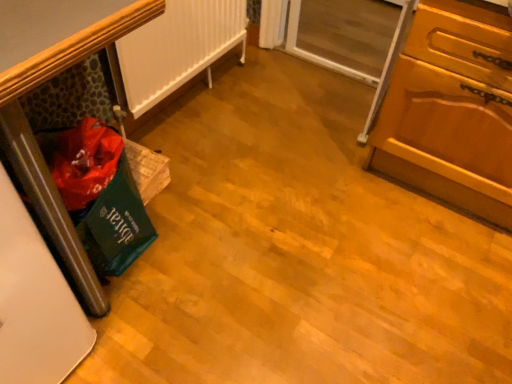
Find the location of a particular element. Image resolution: width=512 pixels, height=384 pixels. free space to the right of green fabric bag at left is located at coordinates (192, 244).